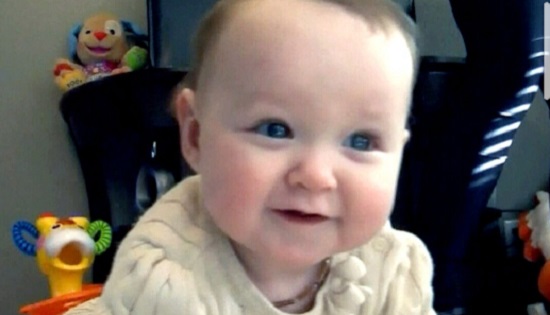
You are a GUI agent. You are given a task and a screenshot of the screen. Output one action in this format:
    pyautogui.click(x=<x>, y=<y>)
    Task: Click on the toys
    Image resolution: width=550 pixels, height=315 pixels.
    Given the screenshot: What is the action you would take?
    pyautogui.click(x=104, y=34), pyautogui.click(x=71, y=234)